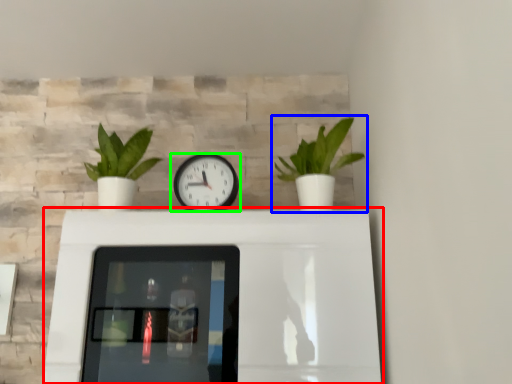
Question: Which object is the closest to the table (highlighted by a red box)? Choose among these: houseplant (highlighted by a blue box) or wall clock (highlighted by a green box).

Choices:
 (A) houseplant
 (B) wall clock

Answer: (B)